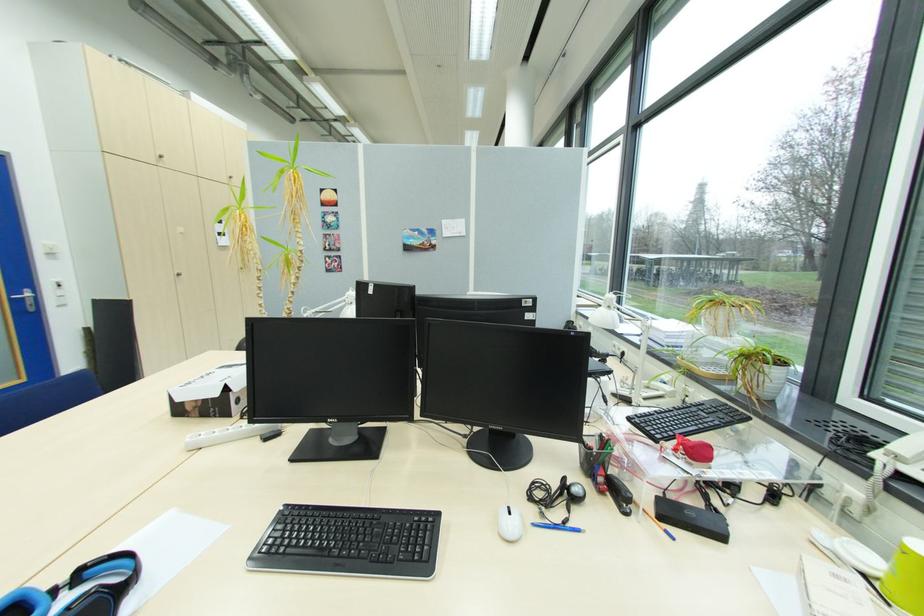
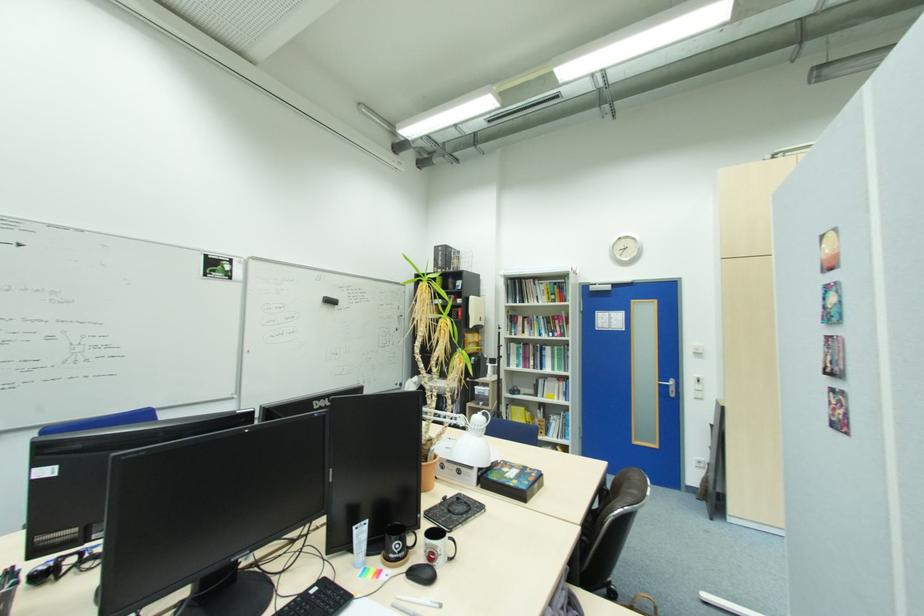
Find the pixel in the second image that matches [26,300] in the first image.

(671, 386)